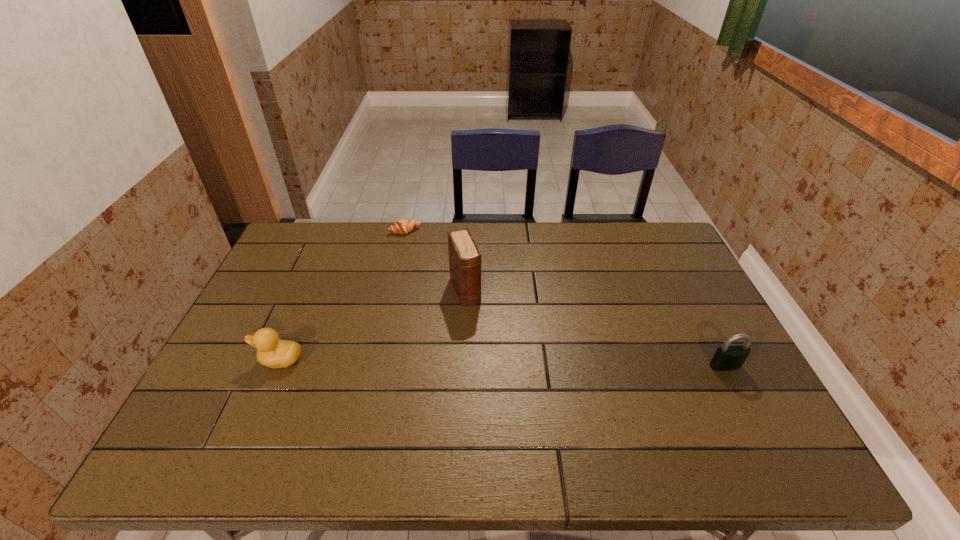
Where is `free space at the near edge`? This screenshot has height=540, width=960. free space at the near edge is located at coordinates (390, 391).

The height and width of the screenshot is (540, 960). What are the coordinates of `free space at the right edge` in the screenshot? It's located at (684, 354).

Locate an element on the screen. blank area at the far left corner is located at coordinates (281, 265).

Find the location of a particular element. This screenshot has height=540, width=960. free spot at the near left corner of the desktop is located at coordinates [x=268, y=395].

In the image, there is a desktop. Where is `vacant space at the far right corner`? vacant space at the far right corner is located at coordinates (645, 260).

Locate an element on the screen. This screenshot has width=960, height=540. free space between the pastry and the rightmost object is located at coordinates (564, 299).

I want to click on unoccupied position between the third object from right to left and the leftmost object, so click(x=343, y=295).

The height and width of the screenshot is (540, 960). What are the coordinates of `free spot between the third object from left to right and the duckling` in the screenshot? It's located at (372, 325).

Locate an element on the screen. The height and width of the screenshot is (540, 960). vacant point located between the padlock and the tallest object is located at coordinates (595, 328).

I want to click on free spot between the duckling and the diary, so click(x=372, y=325).